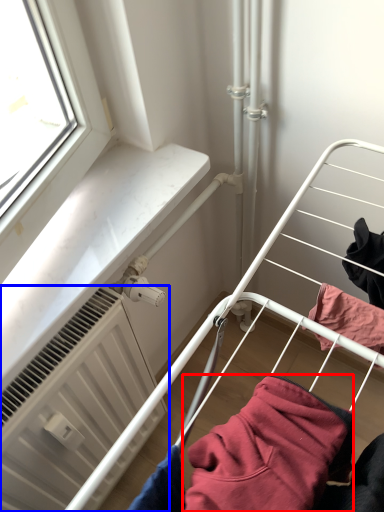
Question: Which of the following is the farthest to the observer, clothing (highlighted by a red box) or radiator (highlighted by a blue box)?

Choices:
 (A) clothing
 (B) radiator

Answer: (B)